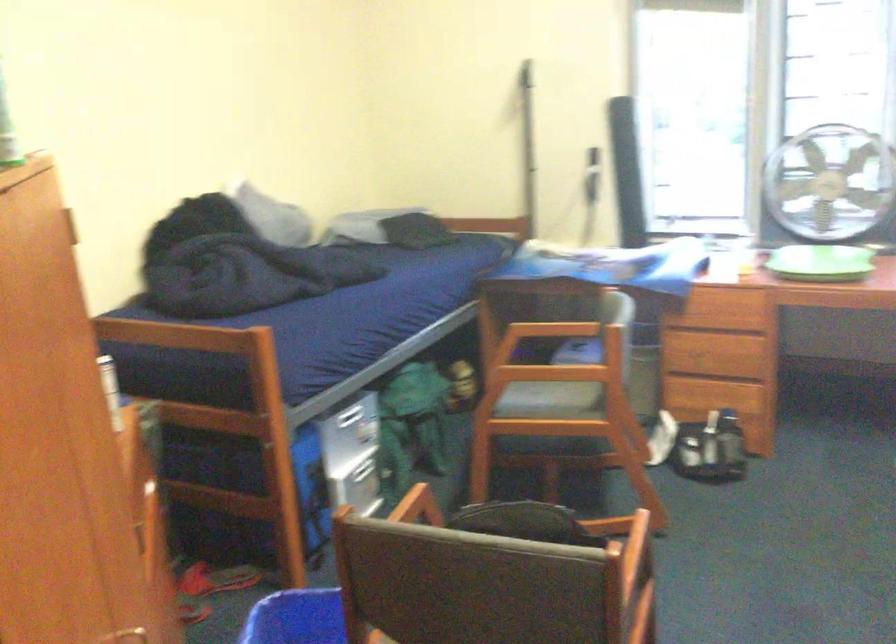
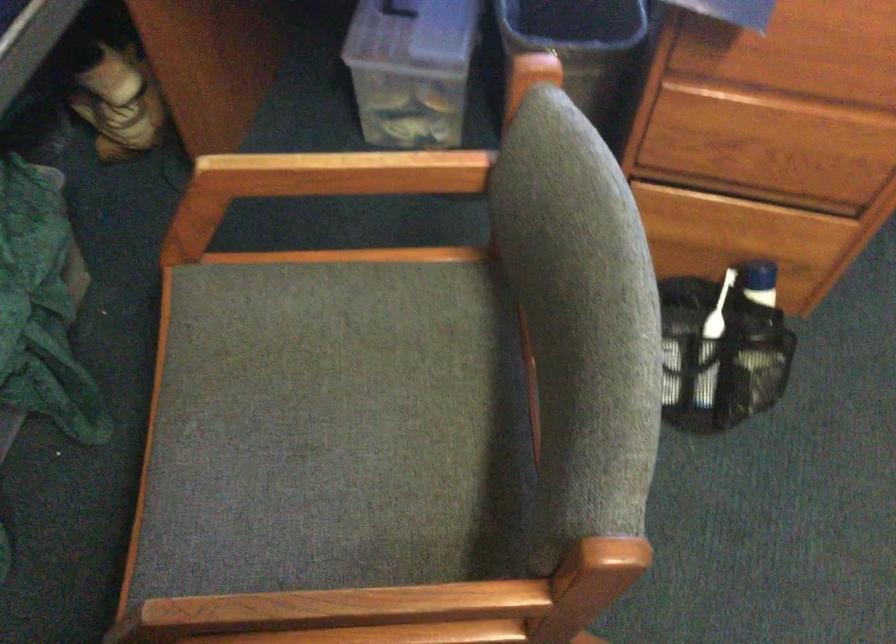
In the second image, find the point that corresponds to point (736, 422) in the first image.

(757, 303)